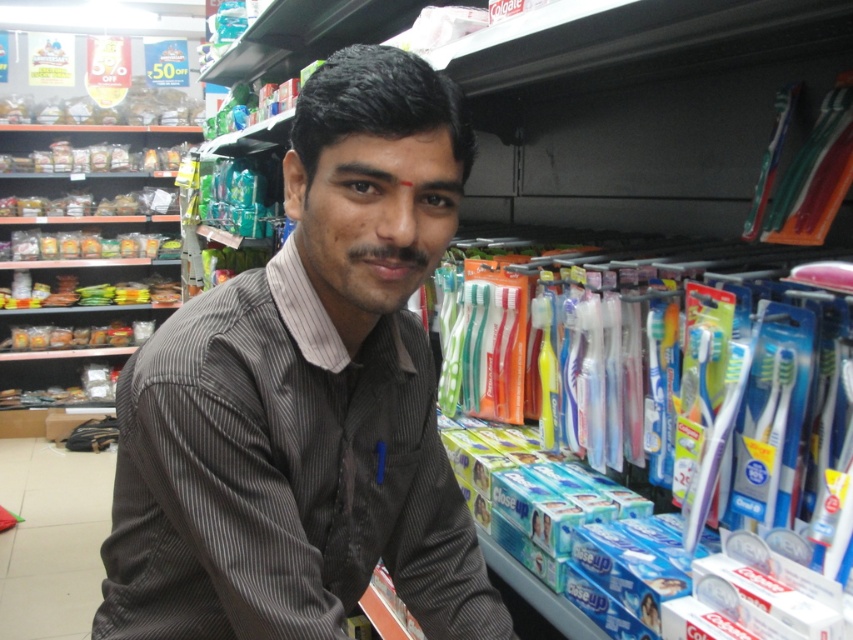
Question: Can you confirm if dark gray striped shirt at center is positioned below translucent plastic toothbrush at right?

Choices:
 (A) yes
 (B) no

Answer: (A)

Question: Can you confirm if dark gray striped shirt at center is thinner than translucent plastic toothbrush at right?

Choices:
 (A) no
 (B) yes

Answer: (A)

Question: Which object is positioned farthest from the dark gray striped shirt at center?

Choices:
 (A) translucent plastic toothbrush at right
 (B) translucent plastic toothbrush at upper right

Answer: (B)

Question: Estimate the real-world distances between objects in this image. Which object is closer to the translucent plastic toothbrush at right?

Choices:
 (A) translucent plastic toothbrush at upper right
 (B) dark gray striped shirt at center

Answer: (A)

Question: Is translucent plastic toothbrush at right positioned before translucent plastic toothbrush at upper right?

Choices:
 (A) no
 (B) yes

Answer: (B)

Question: Which point appears closest to the camera in this image?

Choices:
 (A) (323, 570)
 (B) (763, 326)
 (C) (759, 193)

Answer: (A)